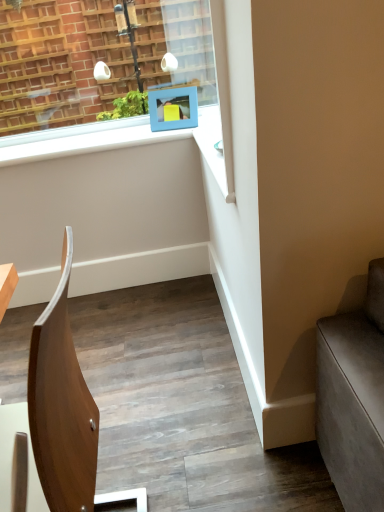
Question: Is point (185, 95) positioned closer to the camera than point (36, 323)?

Choices:
 (A) closer
 (B) farther

Answer: (B)

Question: Is blue matte picture frame at upper center taller or shorter than wooden chair at center?

Choices:
 (A) short
 (B) tall

Answer: (A)

Question: Is blue matte picture frame at upper center in front of or behind wooden chair at center in the image?

Choices:
 (A) front
 (B) behind

Answer: (B)

Question: In terms of size, does wooden chair at center appear bigger or smaller than blue matte picture frame at upper center?

Choices:
 (A) big
 (B) small

Answer: (A)

Question: From the image's perspective, relative to blue matte picture frame at upper center, is wooden chair at center above or below?

Choices:
 (A) above
 (B) below

Answer: (B)

Question: In terms of width, does wooden chair at center look wider or thinner when compared to blue matte picture frame at upper center?

Choices:
 (A) wide
 (B) thin

Answer: (A)

Question: Considering the relative positions of wooden chair at center and blue matte picture frame at upper center in the image provided, is wooden chair at center to the left or to the right of blue matte picture frame at upper center?

Choices:
 (A) right
 (B) left

Answer: (B)